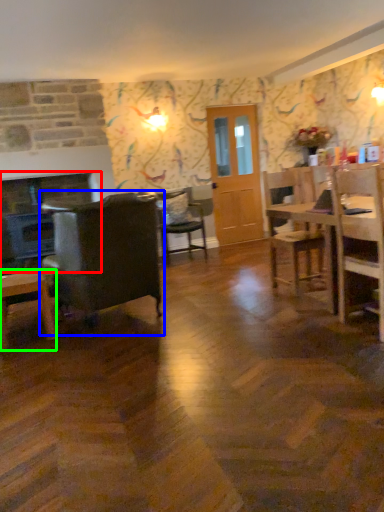
Question: Estimate the real-world distances between objects in this image. Which object is closer to fireplace (highlighted by a red box), chair (highlighted by a blue box) or desk (highlighted by a green box)?

Choices:
 (A) chair
 (B) desk

Answer: (B)